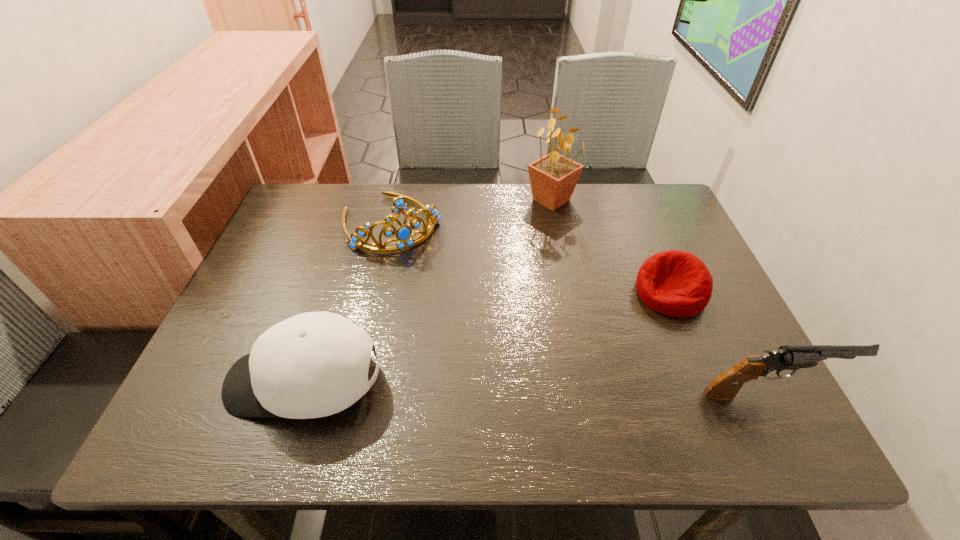
Find the location of a particular element. The width and height of the screenshot is (960, 540). object that is at the left edge is located at coordinates (315, 364).

This screenshot has width=960, height=540. Identify the location of gun situated at the right edge. (725, 386).

The height and width of the screenshot is (540, 960). What are the coordinates of `beanbag present at the right edge` in the screenshot? It's located at (676, 283).

Image resolution: width=960 pixels, height=540 pixels. What are the coordinates of `object present at the near left corner` in the screenshot? It's located at (315, 364).

I want to click on object situated at the near right corner, so click(x=725, y=386).

The width and height of the screenshot is (960, 540). In the image, there is a desktop. Find the location of `vacant space at the far edge`. vacant space at the far edge is located at coordinates (494, 208).

What are the coordinates of `free space at the near edge of the desktop` in the screenshot? It's located at (543, 361).

You are a GUI agent. You are given a task and a screenshot of the screen. Output one action in this format:
    pyautogui.click(x=<x>, y=<y>)
    Task: Click on the vacant space at the left edge
    The width and height of the screenshot is (960, 540).
    Given the screenshot: What is the action you would take?
    pyautogui.click(x=286, y=316)

Where is `free region at the right edge of the desktop`? Image resolution: width=960 pixels, height=540 pixels. free region at the right edge of the desktop is located at coordinates (722, 356).

This screenshot has width=960, height=540. In the image, there is a desktop. Identify the location of free region at the far right corner. (675, 219).